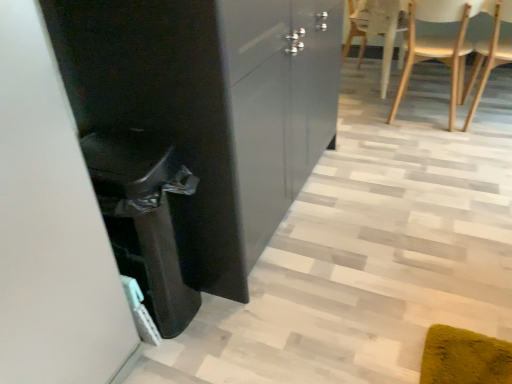
Question: From a real-world perspective, relative to wooden at right, positioned as the first chair in right-to-left order, is white wood chair at upper right, which is the 2th chair from right to left, vertically above or below?

Choices:
 (A) below
 (B) above

Answer: (A)

Question: Visually, is white wood chair at upper right, which is the 2th chair from right to left, positioned to the left or to the right of wooden at right, which is the 2th chair from left to right?

Choices:
 (A) right
 (B) left

Answer: (B)

Question: Estimate the real-world distances between objects in this image. Which object is closer to the wooden at right, positioned as the first chair in right-to-left order?

Choices:
 (A) glossy black cabinet at center
 (B) white wood chair at upper right, which is the 2th chair from right to left

Answer: (B)

Question: Which is farther from the glossy black cabinet at center?

Choices:
 (A) wooden at right, which is the 2th chair from left to right
 (B) white wood chair at upper right, which is the 1th chair from left to right

Answer: (A)